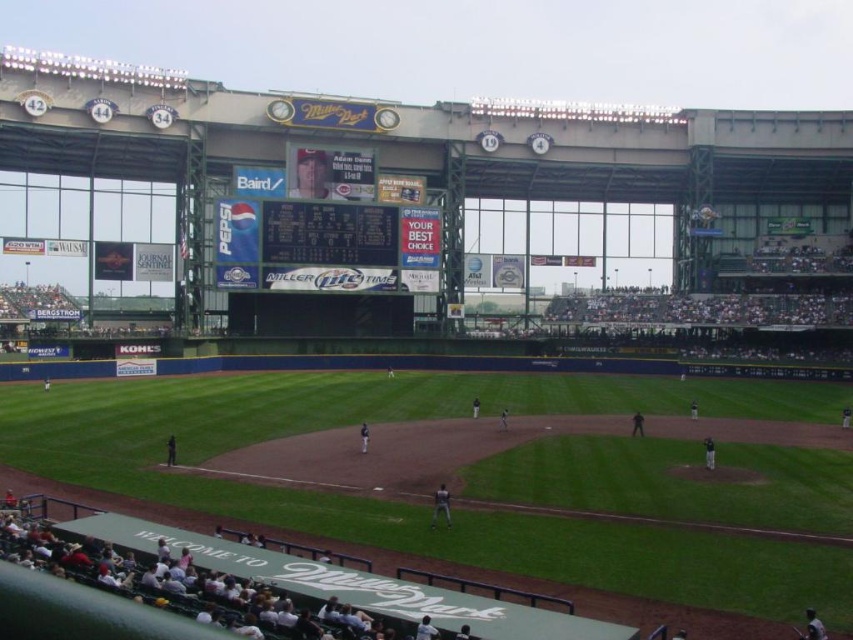
Is green grass field at center closer to camera compared to black plastic scoreboard at center?

Yes, green grass field at center is closer to the viewer.

Does point (825, 584) lie behind point (325, 262)?

No.

Is point (728, 518) farther from camera compared to point (292, 252)?

That is False.

Find the location of a particular element. This screenshot has width=853, height=640. green grass field at center is located at coordinates (489, 474).

Is point (352, 234) positioned behind point (444, 513)?

That is True.

Between black plastic scoreboard at center and dark gray uniform at center, which one has less height?

Standing shorter between the two is dark gray uniform at center.

The height and width of the screenshot is (640, 853). What do you see at coordinates (329, 234) in the screenshot? I see `black plastic scoreboard at center` at bounding box center [329, 234].

At what (x,y) coordinates should I click in order to perform the action: click on black plastic scoreboard at center. Please return your answer as a coordinate pair (x, y). The image size is (853, 640). Looking at the image, I should click on (329, 234).

Who is lower down, dark green fabric banner at lower center or dark gray uniform at center?

dark green fabric banner at lower center is below.

Who is more distant from viewer, (10, 508) or (436, 513)?

Point (436, 513)

You are a GUI agent. You are given a task and a screenshot of the screen. Output one action in this format:
    pyautogui.click(x=<x>, y=<y>)
    Task: Click on the dark green fabric banner at lower center
    
    Given the screenshot: What is the action you would take?
    pyautogui.click(x=189, y=582)

Image resolution: width=853 pixels, height=640 pixels. Find the location of `dark green fabric banner at lower center`. dark green fabric banner at lower center is located at coordinates (189, 582).